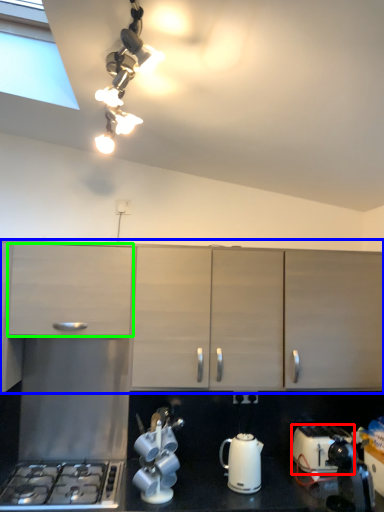
Question: Which is farther away from toaster (highlighted by a red box)? cabinetry (highlighted by a blue box) or cabinetry (highlighted by a green box)?

Choices:
 (A) cabinetry
 (B) cabinetry

Answer: (B)